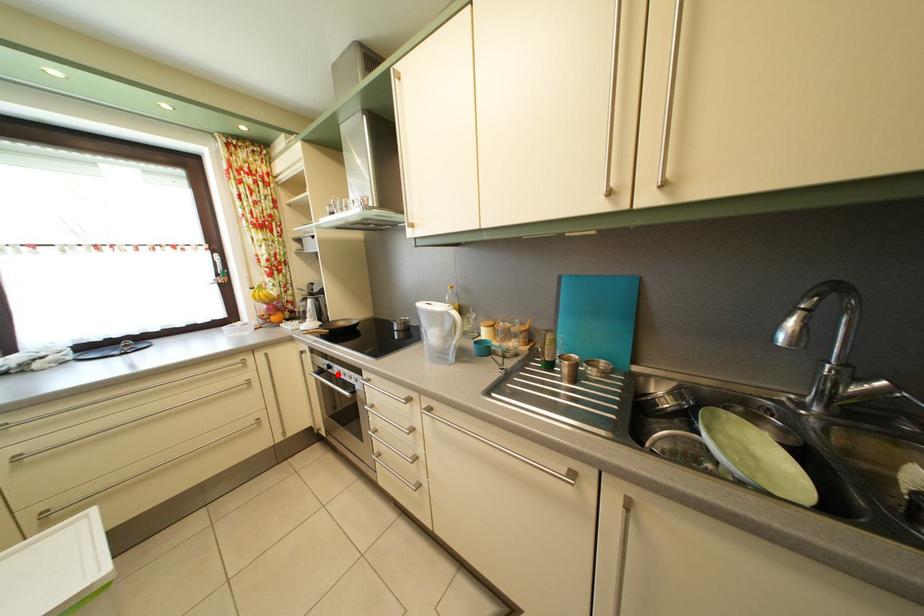
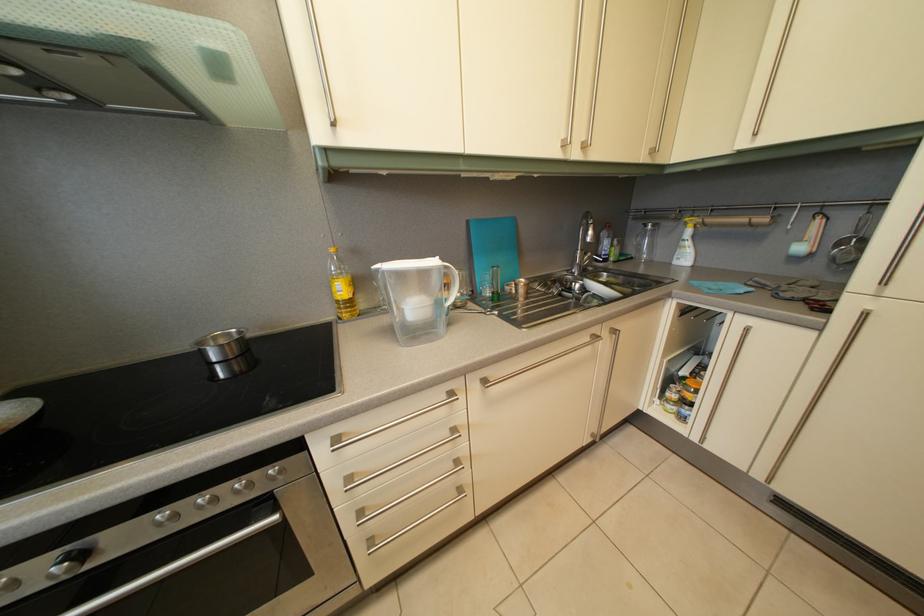
Question: I am providing you with two images of the same scene from different viewpoints. Given a red point in image1, look at the same physical point in image2. Is it:

Choices:
 (A) Closer to the viewpoint
 (B) Farther from the viewpoint

Answer: (A)